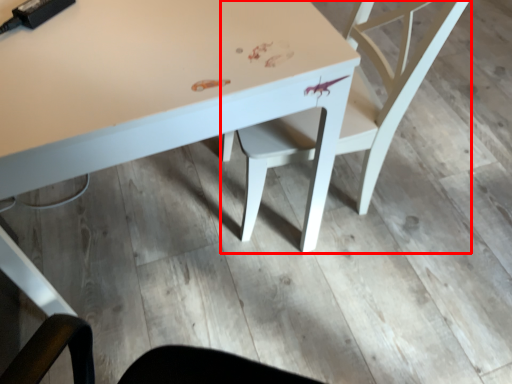
Question: From the image's perspective, considering the relative positions of chair (annotated by the red box) and table in the image provided, where is chair (annotated by the red box) located with respect to the staircase?

Choices:
 (A) below
 (B) above

Answer: (A)